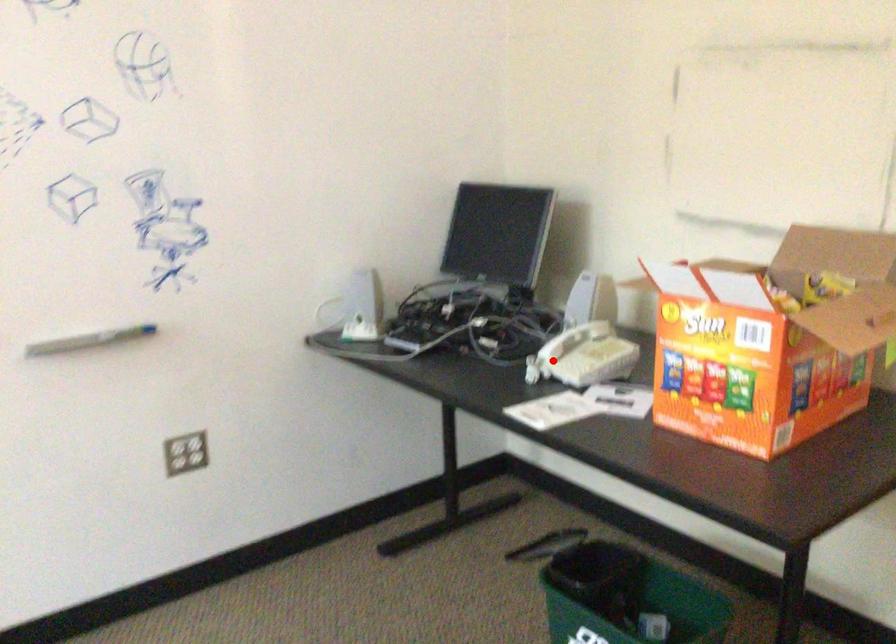
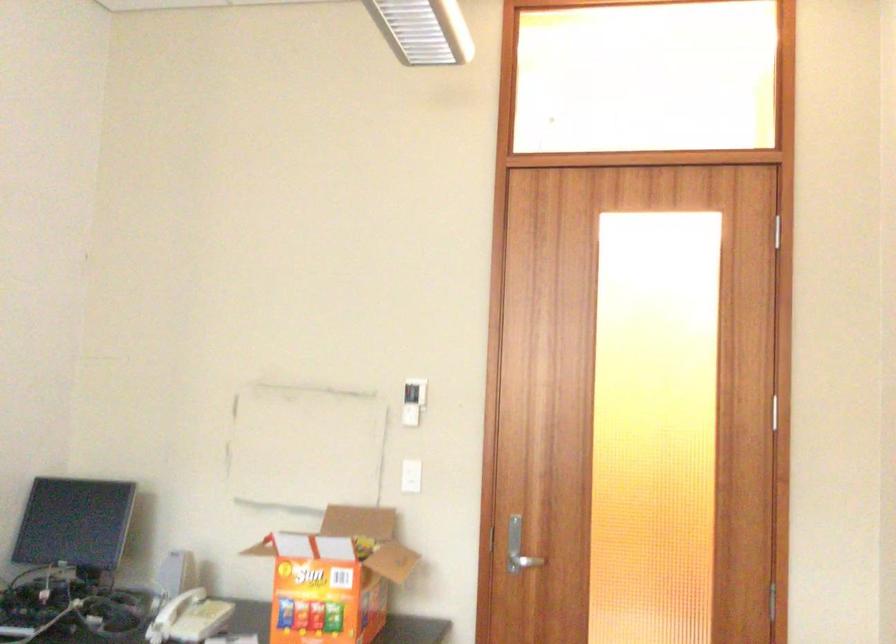
Question: I am providing you with two images of the same scene from different viewpoints. Image1 has a red point marked. In image2, the corresponding 3D location appears at what relative position? Reply with the corresponding letter.

Choices:
 (A) Closer
 (B) Farther

Answer: (B)